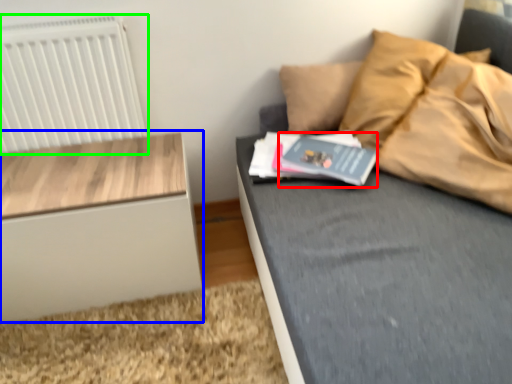
Question: Based on their relative distances, which object is farther from paperback book (highlighted by a red box)? Choose from nightstand (highlighted by a blue box) and radiator (highlighted by a green box).

Choices:
 (A) nightstand
 (B) radiator

Answer: (B)